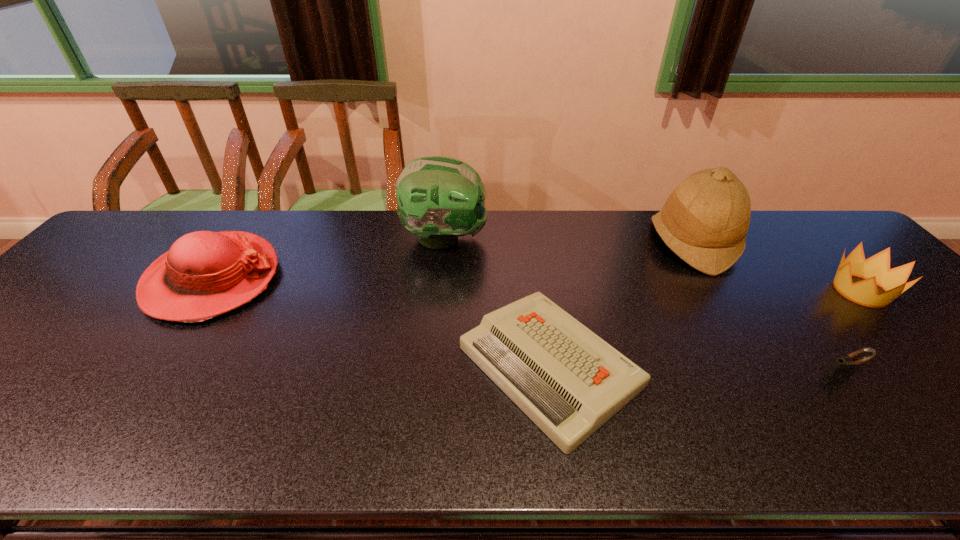
You are a GUI agent. You are given a task and a screenshot of the screen. Output one action in this format:
    pyautogui.click(x=<x>, y=<y>)
    Task: Click on the vacant area situated on the front-facing side of the right hat
    
    Given the screenshot: What is the action you would take?
    pyautogui.click(x=559, y=242)

Identify the location of blank area located on the visor of the football helmet. (615, 238).

You are a GUI agent. You are given a task and a screenshot of the screen. Output one action in this format:
    pyautogui.click(x=<x>, y=<y>)
    Task: Click on the vacant point located at the front of the leftmost object with a bow
    The width and height of the screenshot is (960, 540).
    Given the screenshot: What is the action you would take?
    pyautogui.click(x=340, y=279)

Find the location of a particular element. The height and width of the screenshot is (540, 960). vacant point located 0.290m on the left of the crown is located at coordinates (721, 291).

Identify the location of vacant region located 0.110m with the keyhole on the front of the padlock. tap(880, 423).

Where is `vacant area located 0.370m on the back of the shortest object`? This screenshot has height=540, width=960. vacant area located 0.370m on the back of the shortest object is located at coordinates (529, 221).

At what (x,y) coordinates should I click in order to perform the action: click on football helmet that is at the far edge. Please return your answer as a coordinate pair (x, y). Looking at the image, I should click on (440, 198).

The height and width of the screenshot is (540, 960). Identify the location of object at the near edge. (569, 381).

At what (x,y) coordinates should I click in order to perform the action: click on object present at the right edge. Please return your answer as a coordinate pair (x, y). This screenshot has height=540, width=960. Looking at the image, I should click on (875, 270).

This screenshot has height=540, width=960. Find the location of `vacant space at the far edge of the desktop`. vacant space at the far edge of the desktop is located at coordinates (579, 217).